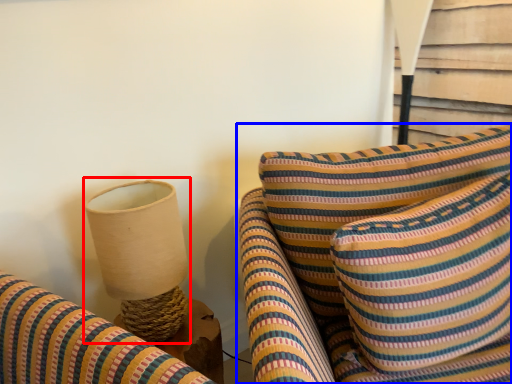
Question: Which of the following is the closest to the observer, table lamp (highlighted by a red box) or furniture (highlighted by a blue box)?

Choices:
 (A) table lamp
 (B) furniture

Answer: (B)